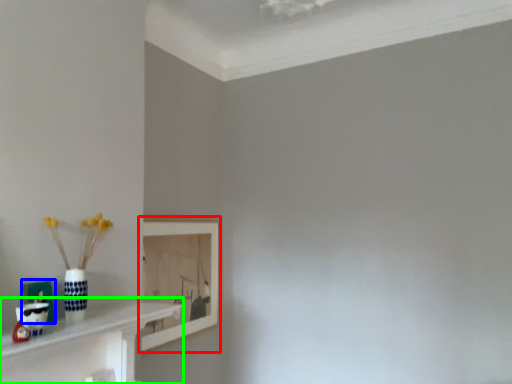
Question: Estimate the real-world distances between objects in this image. Which object is farther from picture frame (highlighted by a red box), picture frame (highlighted by a blue box) or shelf (highlighted by a green box)?

Choices:
 (A) picture frame
 (B) shelf

Answer: (A)